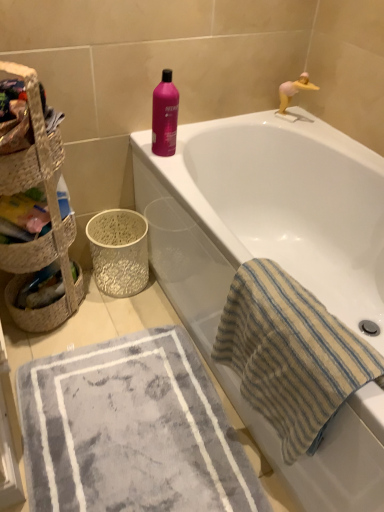
Find the location of a particular element. The image size is (384, 512). empty space that is in between woven straw basket at left, arranged as the 1th basket when ordered from the bottom, and white textured basket at lower left, acting as the second basket container starting from the front is located at coordinates (105, 314).